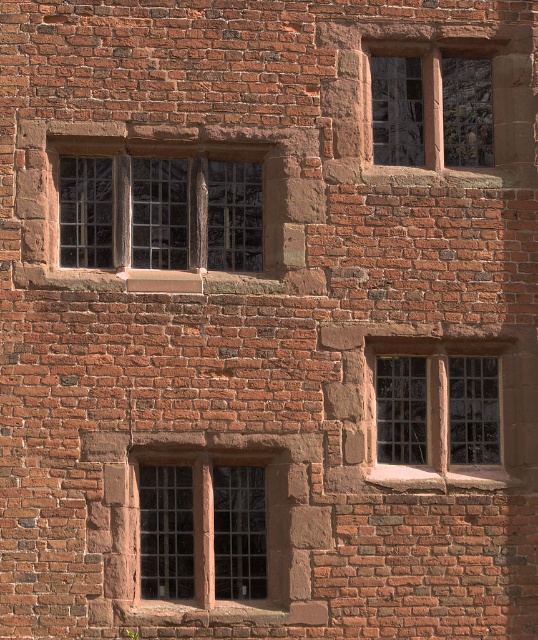
Question: Is clear glass window at upper center smaller than matte stone window at upper right?

Choices:
 (A) yes
 (B) no

Answer: (B)

Question: Observing the image, what is the correct spatial positioning of stone textured window at lower right in reference to matte stone window at upper right?

Choices:
 (A) right
 (B) left

Answer: (B)

Question: From the image, what is the correct spatial relationship of clear glass window at center in relation to stone textured window at lower right?

Choices:
 (A) below
 (B) above

Answer: (A)

Question: Which point is farther to the camera?

Choices:
 (A) clear glass window at center
 (B) clear glass window at upper center
 (C) stone textured window at lower right

Answer: (B)

Question: Estimate the real-world distances between objects in this image. Which object is closer to the stone textured window at lower right?

Choices:
 (A) clear glass window at upper center
 (B) clear glass window at center

Answer: (B)

Question: Which point is farther from the camera taking this photo?

Choices:
 (A) (208, 509)
 (B) (74, 179)

Answer: (B)